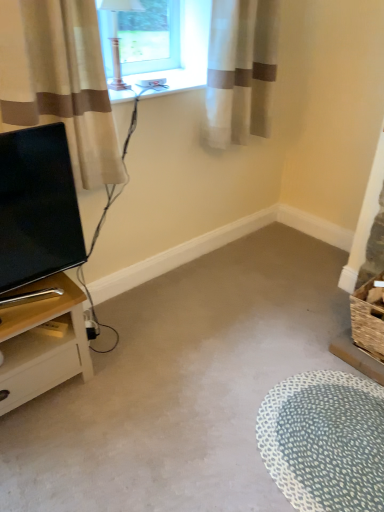
Image resolution: width=384 pixels, height=512 pixels. I want to click on vacant area that is in front of light wood nightstand at left, so click(45, 454).